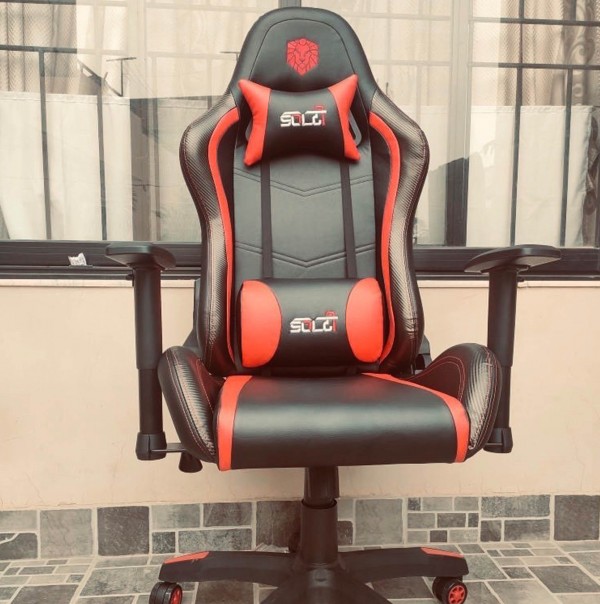
Where is `window`? This screenshot has width=600, height=604. window is located at coordinates (105, 151), (533, 194).